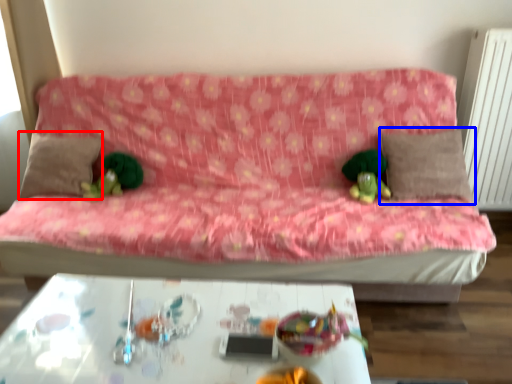
Question: Which object appears farthest to the camera in this image, pillow (highlighted by a red box) or pillow (highlighted by a blue box)?

Choices:
 (A) pillow
 (B) pillow

Answer: (A)